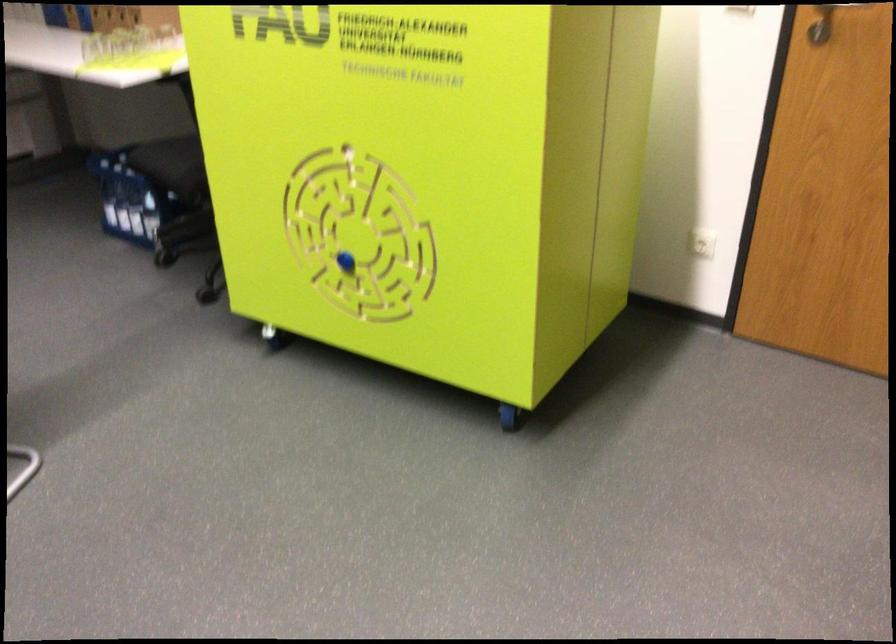
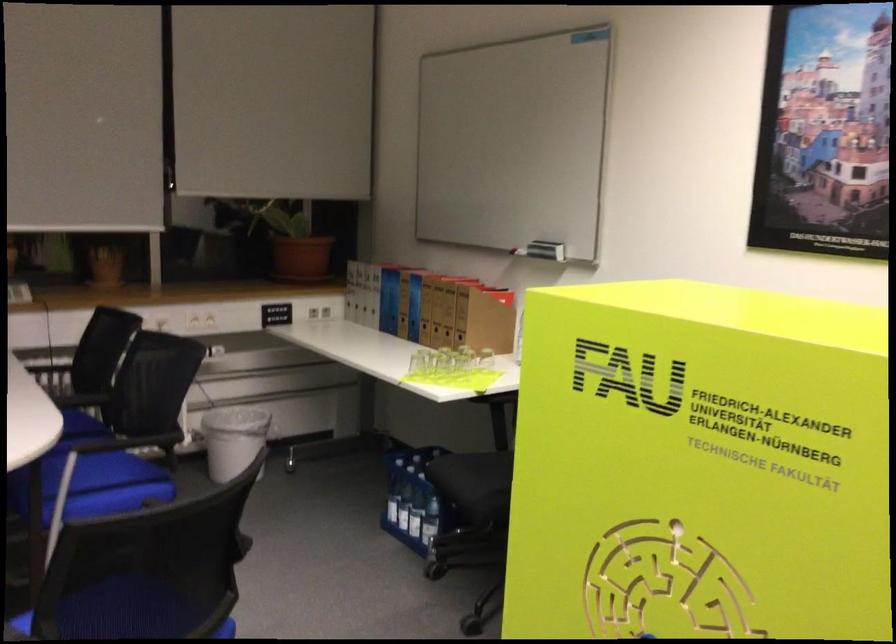
Which direction would the cameraman need to move to produce the second image?

The cameraman moved toward left, forward.